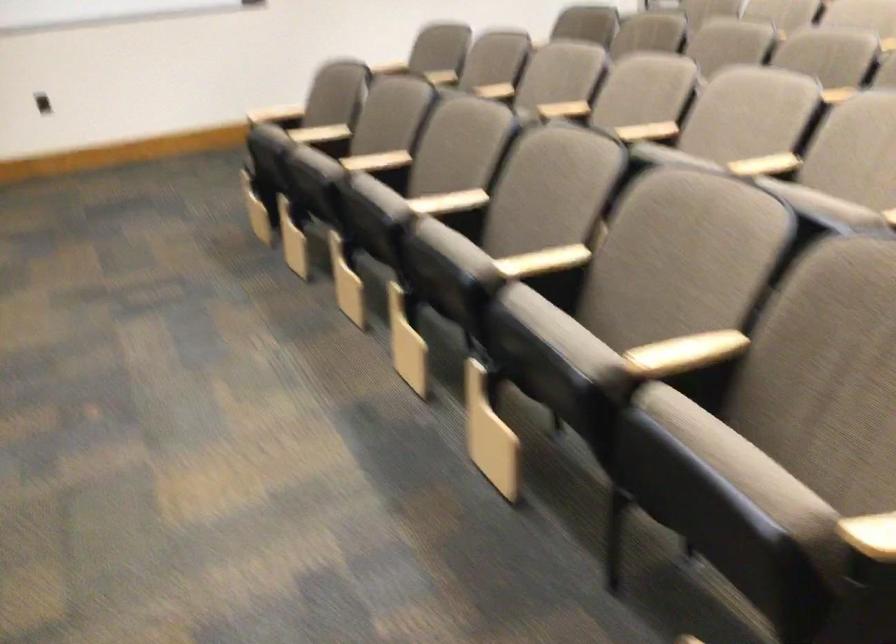
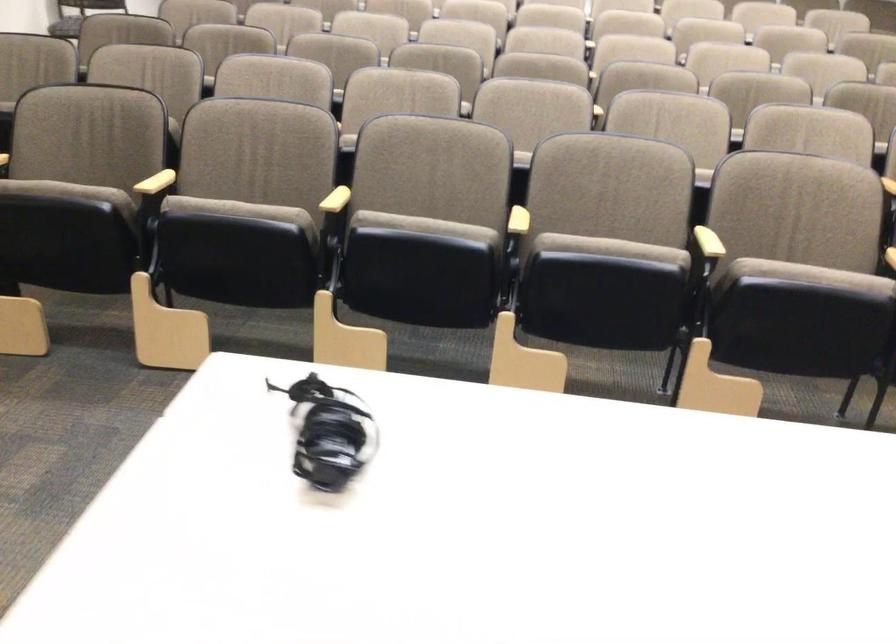
In the second image, find the point that corresponds to (x=363, y=191) in the first image.

(424, 225)